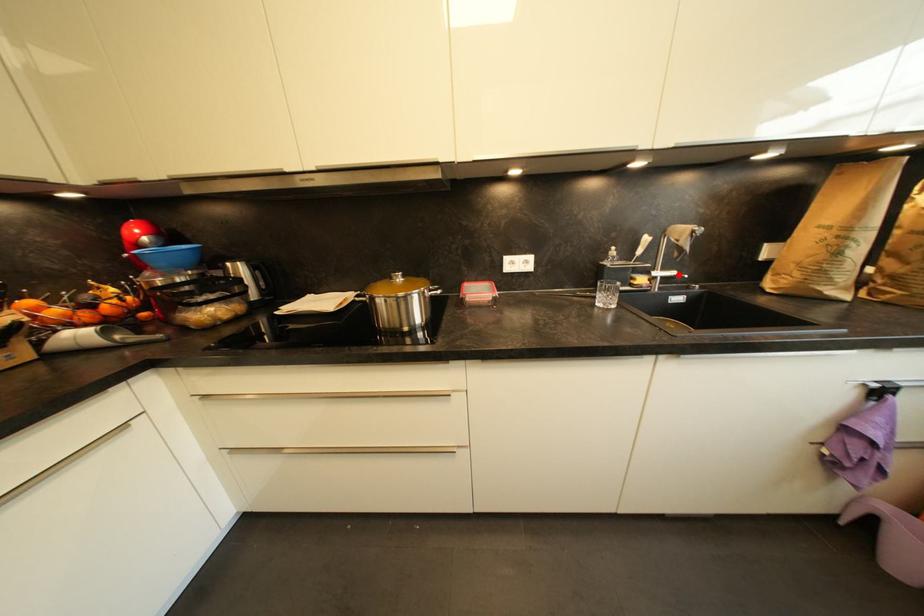
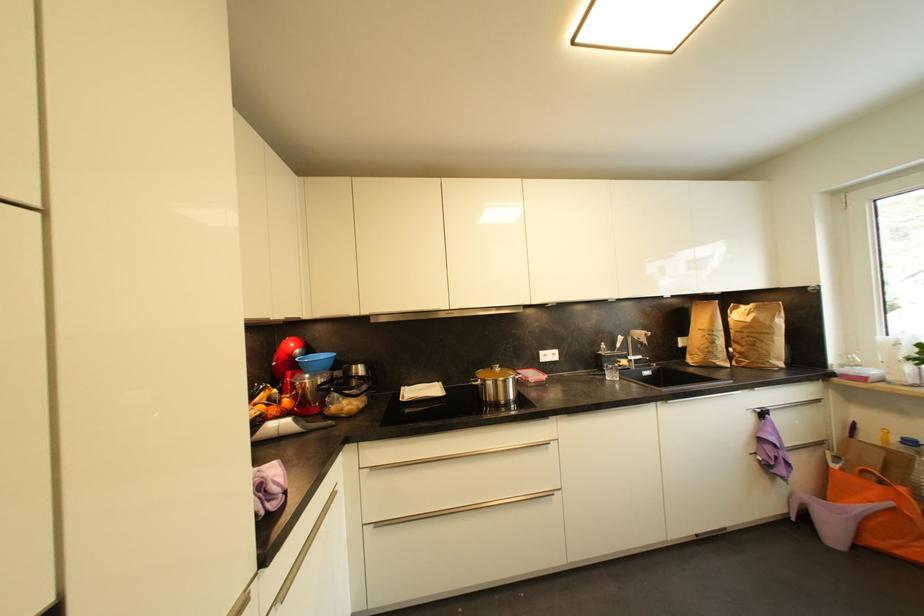
The point at the highlighted location is marked in the first image. Where is the corresponding point in the second image?

(645, 359)